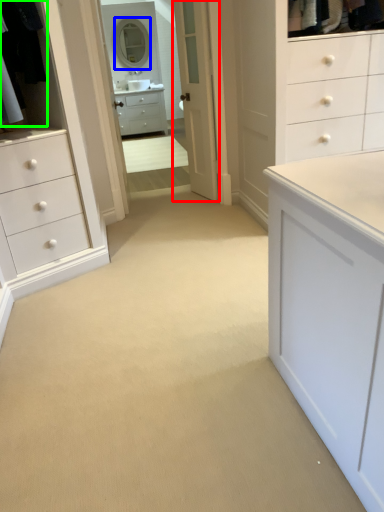
Question: Which object is positioned farthest from door (highlighted by a red box)? Select from mirror (highlighted by a blue box) and laundry (highlighted by a green box).

Choices:
 (A) mirror
 (B) laundry

Answer: (A)